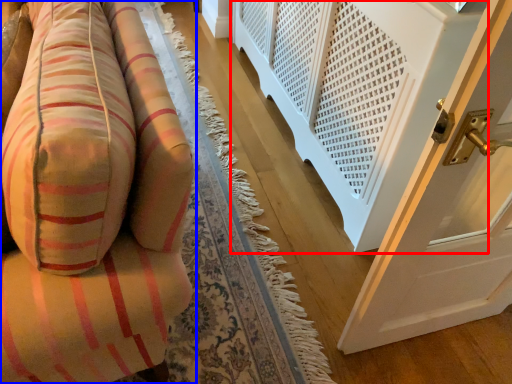
Question: Which of the following is the farthest to the observer, balustrade (highlighted by a red box) or furniture (highlighted by a blue box)?

Choices:
 (A) balustrade
 (B) furniture

Answer: (A)